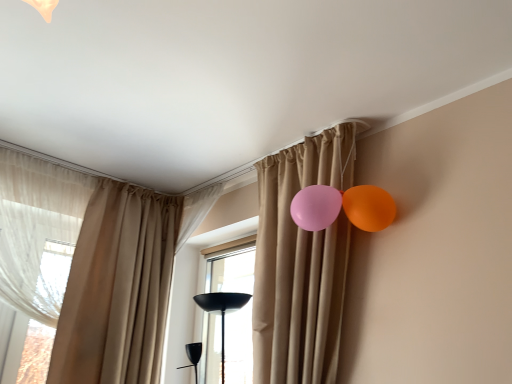
Question: Is sheer white curtain at left, the 4th curtain viewed from the right, next to transparent glass window at center and touching it?

Choices:
 (A) yes
 (B) no

Answer: (B)

Question: Can transparent glass window at center be found inside sheer white curtain at left, the 4th curtain viewed from the right?

Choices:
 (A) no
 (B) yes

Answer: (A)

Question: From a real-world perspective, does sheer white curtain at left, the 4th curtain viewed from the right, stand above transparent glass window at center?

Choices:
 (A) no
 (B) yes

Answer: (B)

Question: Is sheer white curtain at left, the 4th curtain viewed from the right, at the left side of transparent glass window at center?

Choices:
 (A) no
 (B) yes

Answer: (B)

Question: Would you say sheer white curtain at left, the 4th curtain viewed from the right, is outside transparent glass window at center?

Choices:
 (A) yes
 (B) no

Answer: (A)

Question: Is matte beige curtain at upper center, the 4th curtain in the left-to-right sequence, in front of or behind transparent glass window at center in the image?

Choices:
 (A) behind
 (B) front

Answer: (B)

Question: From a real-world perspective, is matte beige curtain at upper center, which ranks as the first curtain in right-to-left order, positioned above or below transparent glass window at center?

Choices:
 (A) above
 (B) below

Answer: (A)

Question: Is point (275, 281) closer or farther from the camera than point (243, 279)?

Choices:
 (A) farther
 (B) closer

Answer: (B)

Question: Is matte beige curtain at upper center, the 4th curtain in the left-to-right sequence, wider or thinner than transparent glass window at center?

Choices:
 (A) wide
 (B) thin

Answer: (A)

Question: Is transparent glass window at center bigger or smaller than beige fabric curtain at center, which ranks as the 3th curtain in left-to-right order?

Choices:
 (A) small
 (B) big

Answer: (B)

Question: Visually, is transparent glass window at center positioned to the left or to the right of beige fabric curtain at center, which ranks as the 3th curtain in left-to-right order?

Choices:
 (A) right
 (B) left

Answer: (A)

Question: Is point (209, 365) closer or farther from the camera than point (192, 200)?

Choices:
 (A) farther
 (B) closer

Answer: (B)

Question: From a real-world perspective, is transparent glass window at center positioned above or below beige fabric curtain at center, which is the second curtain from right to left?

Choices:
 (A) above
 (B) below

Answer: (B)

Question: In terms of height, does sheer white curtain at left, the 4th curtain viewed from the right, look taller or shorter compared to beige fabric curtain at center, which is the second curtain from right to left?

Choices:
 (A) short
 (B) tall

Answer: (B)

Question: Which is correct: sheer white curtain at left, the 4th curtain viewed from the right, is inside beige fabric curtain at center, which is the second curtain from right to left, or outside of it?

Choices:
 (A) inside
 (B) outside

Answer: (B)